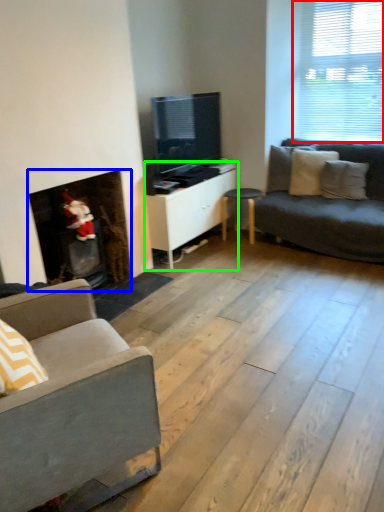
Question: Which object is the farthest from window (highlighted by a red box)? Choose among these: fireplace (highlighted by a blue box) or cabinetry (highlighted by a green box).

Choices:
 (A) fireplace
 (B) cabinetry

Answer: (A)